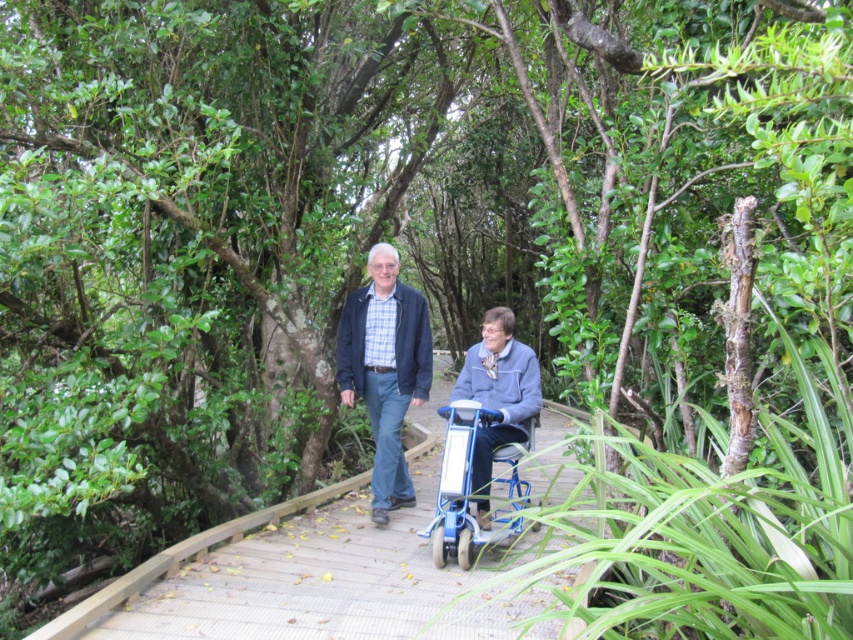
Question: Which object is positioned farthest from the blue metallic wheelchair at center?

Choices:
 (A) blue plaid shirt at center
 (B) blue metallic walker at center
 (C) wooden walkway at center

Answer: (C)

Question: Does blue plaid shirt at center appear on the right side of blue metallic walker at center?

Choices:
 (A) no
 (B) yes

Answer: (A)

Question: Can you confirm if wooden walkway at center is positioned above blue metallic wheelchair at center?

Choices:
 (A) yes
 (B) no

Answer: (B)

Question: Is blue plaid shirt at center thinner than blue metallic wheelchair at center?

Choices:
 (A) yes
 (B) no

Answer: (A)

Question: Based on their relative distances, which object is nearer to the blue metallic walker at center?

Choices:
 (A) blue metallic wheelchair at center
 (B) blue plaid shirt at center
 (C) wooden walkway at center

Answer: (A)

Question: Estimate the real-world distances between objects in this image. Which object is farther from the blue metallic walker at center?

Choices:
 (A) blue metallic wheelchair at center
 (B) wooden walkway at center
 (C) blue plaid shirt at center

Answer: (B)